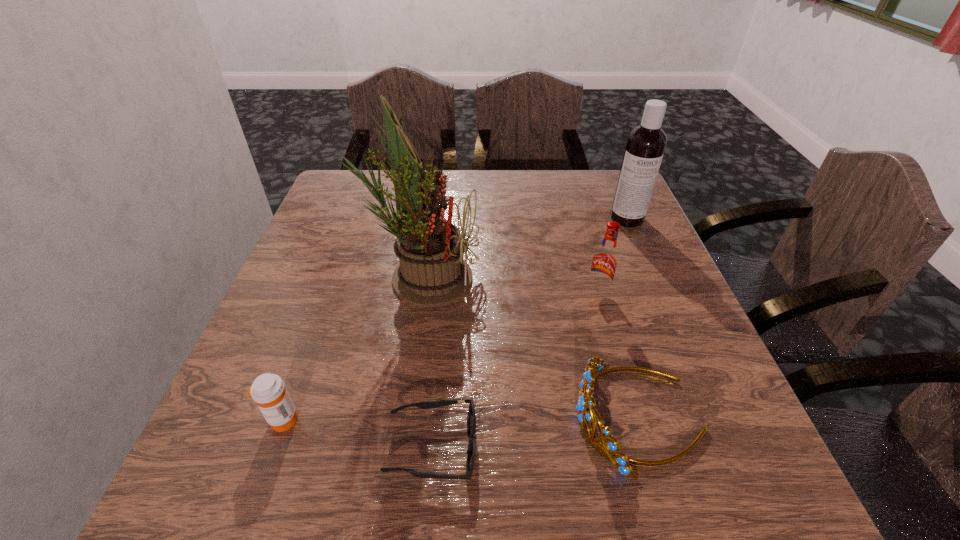
Locate an element on the screen. free space that is in between the dishwasher detergent and the flower arrangement is located at coordinates (525, 248).

Identify the location of blank region between the leftmost object and the root beer. The height and width of the screenshot is (540, 960). (440, 356).

Identify the location of vacant point located between the tallest object and the tiara. The image size is (960, 540). (531, 347).

The image size is (960, 540). In order to click on vacant area that lies between the flower arrangement and the farthest object in this screenshot , I will do `click(525, 248)`.

Locate an element on the screen. This screenshot has width=960, height=540. blank region between the fifth shortest object and the shortest object is located at coordinates (530, 333).

Identify the location of free space between the root beer and the flower arrangement. The height and width of the screenshot is (540, 960). (511, 285).

Where is `blank region between the tiara and the root beer`? blank region between the tiara and the root beer is located at coordinates (618, 355).

The height and width of the screenshot is (540, 960). Identify the location of free point between the leftmost object and the sunglasses. (357, 433).

Locate an element on the screen. The image size is (960, 540). vacant point located between the farthest object and the shortest object is located at coordinates (530, 333).

Point out which object is positioned as the second nearest to the fourth tallest object. Please provide its 2D coordinates. Your answer should be formatted as a tuple, i.e. [(x, y)], where the tuple contains the x and y coordinates of a point satisfying the conditions above.

[(604, 263)]